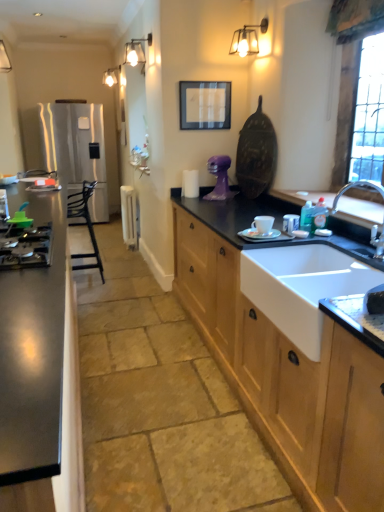
What do you see at coordinates (76, 149) in the screenshot?
I see `satin silver refrigerator at left` at bounding box center [76, 149].

In order to face shiny metallic gas stove at left, should I rotate leftwards or rightwards?

To align with it, rotate left about 21.932°.

Describe the element at coordinates (27, 248) in the screenshot. I see `shiny metallic gas stove at left` at that location.

What do you see at coordinates (247, 39) in the screenshot?
I see `metallic wall sconce at upper center, the second light fixture viewed from the back` at bounding box center [247, 39].

I want to click on metallic wall sconce at upper center, the 2th light fixture in the left-to-right sequence, so click(x=247, y=39).

What do you see at coordinates (220, 178) in the screenshot? I see `purple matte sculpture at center, positioned as the 2th appliance in right-to-left order` at bounding box center [220, 178].

Describe the element at coordinates (205, 105) in the screenshot. This screenshot has height=512, width=384. I see `black matte picture frame at upper center` at that location.

The height and width of the screenshot is (512, 384). What do you see at coordinates (137, 52) in the screenshot? I see `matte glass sconce at upper center, the 1th light fixture in the left-to-right sequence` at bounding box center [137, 52].

Measure the distance between point (138, 53) and camera.

The depth of point (138, 53) is 3.66 meters.

Image resolution: width=384 pixels, height=512 pixels. Identify the location of satin silver refrigerator at left. (76, 149).

From the image's perspective, would you say white ceramic cup at center, marked as the 1th appliance in a front-to-back arrangement, is positioned over purple matte sculpture at center, placed as the second appliance when sorted from back to front?

No, from the image's perspective, white ceramic cup at center, marked as the 1th appliance in a front-to-back arrangement, is not over purple matte sculpture at center, placed as the second appliance when sorted from back to front.

Who is smaller, white ceramic cup at center, marked as the 1th appliance in a front-to-back arrangement, or purple matte sculpture at center, the second appliance from the front?

white ceramic cup at center, marked as the 1th appliance in a front-to-back arrangement.

Is white ceramic cup at center, which appears as the 3th appliance when viewed from the back, facing away from purple matte sculpture at center, the second appliance from the front?

No, purple matte sculpture at center, the second appliance from the front, is not at the back of white ceramic cup at center, which appears as the 3th appliance when viewed from the back.

From a real-world perspective, between wooden cabinet at lower right, the 1th cabinetry when ordered from right to left, and white ceramic sink at lower right, who is vertically lower?

wooden cabinet at lower right, the 1th cabinetry when ordered from right to left.

Would you say wooden cabinet at lower right, the 1th cabinetry when ordered from right to left, is inside or outside white ceramic sink at lower right?

wooden cabinet at lower right, the 1th cabinetry when ordered from right to left, is located beyond the bounds of white ceramic sink at lower right.

How different are the orientations of wooden cabinet at lower right, the 2th cabinetry in the left-to-right sequence, and white ceramic sink at lower right in degrees?

The angular difference between wooden cabinet at lower right, the 2th cabinetry in the left-to-right sequence, and white ceramic sink at lower right is 0.216 degrees.

Is wooden cabinet at lower right, the 2th cabinetry in the left-to-right sequence, at the right side of white ceramic sink at lower right?

No.

Is white ceramic sink at lower right oriented away from matte glass sconce at upper center, which is the second light fixture from front to back?

No, white ceramic sink at lower right's orientation is not away from matte glass sconce at upper center, which is the second light fixture from front to back.

Is white ceramic sink at lower right positioned far away from matte glass sconce at upper center, the 1th light fixture in the left-to-right sequence?

Yes, white ceramic sink at lower right and matte glass sconce at upper center, the 1th light fixture in the left-to-right sequence, are located far from each other.

Who is smaller, white ceramic sink at lower right or matte glass sconce at upper center, which is the second light fixture from front to back?

matte glass sconce at upper center, which is the second light fixture from front to back, is smaller.

Considering the relative sizes of white ceramic sink at lower right and matte glass sconce at upper center, the first light fixture viewed from the back, in the image provided, is white ceramic sink at lower right taller than matte glass sconce at upper center, the first light fixture viewed from the back,?

Yes, white ceramic sink at lower right is taller than matte glass sconce at upper center, the first light fixture viewed from the back.

Is metallic wall sconce at upper center, positioned as the first light fixture in front-to-back order, in contact with white plastic radiator at center, the 1th appliance positioned from the left?

No.

From a real-world perspective, is metallic wall sconce at upper center, positioned as the first light fixture in front-to-back order, positioned under white plastic radiator at center, the 1th appliance in the back-to-front sequence, based on gravity?

No, from a real-world perspective, metallic wall sconce at upper center, positioned as the first light fixture in front-to-back order, is not beneath white plastic radiator at center, the 1th appliance in the back-to-front sequence.

Considering the points (237, 46) and (121, 201), which point is behind, point (237, 46) or point (121, 201)?

The point (121, 201) is more distant.

From the image's perspective, which one is positioned higher, metallic wall sconce at upper center, the 2th light fixture in the left-to-right sequence, or white plastic radiator at center, the 1th appliance in the back-to-front sequence?

From the image's view, metallic wall sconce at upper center, the 2th light fixture in the left-to-right sequence, is above.

Could metallic wall sconce at upper center, the 2th light fixture in the left-to-right sequence, be considered to be inside black matte picture frame at upper center?

No, metallic wall sconce at upper center, the 2th light fixture in the left-to-right sequence, is not inside black matte picture frame at upper center.

From a real-world perspective, between black matte picture frame at upper center and metallic wall sconce at upper center, the second light fixture viewed from the back, who is vertically lower?

In real-world perspective, black matte picture frame at upper center is lower.

From the image's perspective, would you say black matte picture frame at upper center is positioned over metallic wall sconce at upper center, which ranks as the first light fixture in right-to-left order?

Actually, black matte picture frame at upper center appears below metallic wall sconce at upper center, which ranks as the first light fixture in right-to-left order, in the image.

You are a GUI agent. You are given a task and a screenshot of the screen. Output one action in this format:
    pyautogui.click(x=<x>, y=<y>)
    Task: Click on the tap located behind the wooden cabinet at lower right, the 1th cabinetry when ordered from right to left
    The height and width of the screenshot is (512, 384).
    Given the screenshot: What is the action you would take?
    pyautogui.click(x=355, y=187)

Would you say chrome metallic faucet at sink right is outside wooden cabinet at lower right, the 1th cabinetry when ordered from right to left?

Yes, chrome metallic faucet at sink right is not within wooden cabinet at lower right, the 1th cabinetry when ordered from right to left.

What's the angular difference between chrome metallic faucet at sink right and wooden cabinet at lower right, the 1th cabinetry when ordered from right to left,'s facing directions?

The facing directions of chrome metallic faucet at sink right and wooden cabinet at lower right, the 1th cabinetry when ordered from right to left, are 0.215 degrees apart.

Considering the sizes of objects satin silver refrigerator at left and clear glass window at upper right in the image provided, who is taller, satin silver refrigerator at left or clear glass window at upper right?

With more height is satin silver refrigerator at left.

From a real-world perspective, which object stands above the other?

From a 3D spatial view, clear glass window at upper right is above.

Which is more to the right, satin silver refrigerator at left or clear glass window at upper right?

clear glass window at upper right is more to the right.

From the image's perspective, who appears lower, satin silver refrigerator at left or clear glass window at upper right?

clear glass window at upper right is shown below in the image.

The height and width of the screenshot is (512, 384). There is a white ceramic cup at center, which appears as the 3th appliance when viewed from the back. Find the location of `the 2nd appliance above it (from the image's perspective)`. the 2nd appliance above it (from the image's perspective) is located at coordinates (220, 178).

Find the location of a particular element. The image size is (384, 512). cabinetry that is the 1st object to the left of the white ceramic sink at lower right, starting at the anchor is located at coordinates (286, 361).

Looking at the image, which one is located further to matte glass sconce at upper center, which is the second light fixture from front to back, purple matte sculpture at center, placed as the second appliance when sorted from back to front, or white ceramic cup at center, marked as the 1th appliance in a front-to-back arrangement?

white ceramic cup at center, marked as the 1th appliance in a front-to-back arrangement, is further to matte glass sconce at upper center, which is the second light fixture from front to back.

Which object lies further to the anchor point black metal chair at left, purple matte sculpture at center, placed as the second appliance when sorted from back to front, or wooden cabinet at lower right, the 2th cabinetry in the left-to-right sequence?

The object further to black metal chair at left is wooden cabinet at lower right, the 2th cabinetry in the left-to-right sequence.

When comparing their distances from satin silver refrigerator at left, does wooden cabinet at lower right, the 2th cabinetry in the left-to-right sequence, or black matte picture frame at upper center seem further?

Among the two, wooden cabinet at lower right, the 2th cabinetry in the left-to-right sequence, is located further to satin silver refrigerator at left.

When comparing their distances from matte glass sconce at upper center, the 2th light fixture viewed from the right, does clear glass window at upper right or shiny metallic gas stove at left seem closer?

clear glass window at upper right is positioned closer to the anchor matte glass sconce at upper center, the 2th light fixture viewed from the right.

Considering their positions, is black metal chair at left positioned further to chrome metallic faucet at sink right than white ceramic sink at lower right?

Based on the image, black metal chair at left appears to be further to chrome metallic faucet at sink right.

Based on their spatial positions, is white ceramic sink at lower right or black matte picture frame at upper center closer to matte glass sconce at upper center, which is the second light fixture from front to back?

black matte picture frame at upper center is closer to matte glass sconce at upper center, which is the second light fixture from front to back.

Considering their positions, is stainless steel cabinet at left, arranged as the 2th cabinetry when viewed from the right, positioned further to black matte picture frame at upper center than purple matte sculpture at center, placed as the second appliance when sorted from back to front?

stainless steel cabinet at left, arranged as the 2th cabinetry when viewed from the right, lies further to black matte picture frame at upper center than the other object.

Based on their spatial positions, is white ceramic cup at center, placed as the third appliance when sorted from left to right, or metallic wall sconce at upper center, positioned as the first light fixture in front-to-back order, closer to stainless steel cabinet at left, arranged as the 2th cabinetry when viewed from the right?

white ceramic cup at center, placed as the third appliance when sorted from left to right, is positioned closer to the anchor stainless steel cabinet at left, arranged as the 2th cabinetry when viewed from the right.

Where is `window between stainless steel cabinet at left, positioned as the first cabinetry in left-to-right order, and metallic wall sconce at upper center, the 2th light fixture in the left-to-right sequence, along the z-axis`? The width and height of the screenshot is (384, 512). window between stainless steel cabinet at left, positioned as the first cabinetry in left-to-right order, and metallic wall sconce at upper center, the 2th light fixture in the left-to-right sequence, along the z-axis is located at coordinates (368, 114).

The width and height of the screenshot is (384, 512). I want to click on tap located between stainless steel cabinet at left, arranged as the 2th cabinetry when viewed from the right, and purple matte sculpture at center, which is the 2th appliance from left to right, in the depth direction, so click(x=355, y=187).

Locate an element on the screen. gas stove situated between stainless steel cabinet at left, arranged as the 2th cabinetry when viewed from the right, and wooden cabinet at lower right, the 1th cabinetry when ordered from right to left, from left to right is located at coordinates click(27, 248).

The width and height of the screenshot is (384, 512). I want to click on gas stove between stainless steel cabinet at left, positioned as the first cabinetry in left-to-right order, and white ceramic cup at center, marked as the 1th appliance in a front-to-back arrangement, in the front-back direction, so click(x=27, y=248).